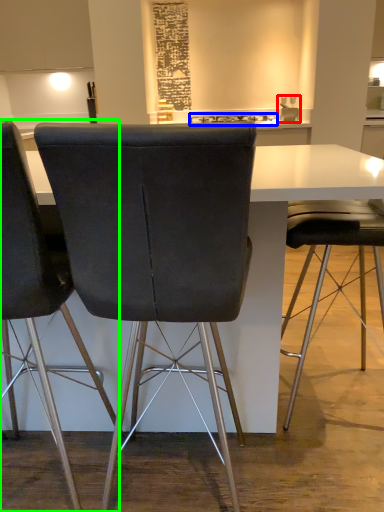
Question: Considering the real-world distances, which object is closest to sink (highlighted by a red box)? appliance (highlighted by a blue box) or chair (highlighted by a green box).

Choices:
 (A) appliance
 (B) chair

Answer: (A)